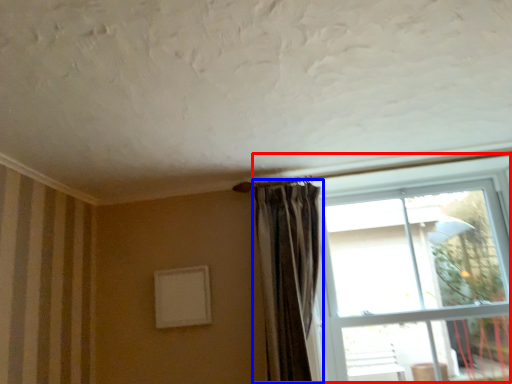
Question: Among these objects, which one is farthest to the camera, window (highlighted by a red box) or curtain (highlighted by a blue box)?

Choices:
 (A) window
 (B) curtain

Answer: (B)